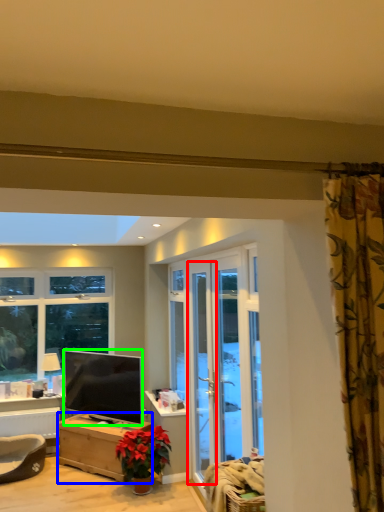
Question: Which is farther away from screen door (highlighted by a red box)? desk (highlighted by a blue box) or television (highlighted by a green box)?

Choices:
 (A) desk
 (B) television

Answer: (A)